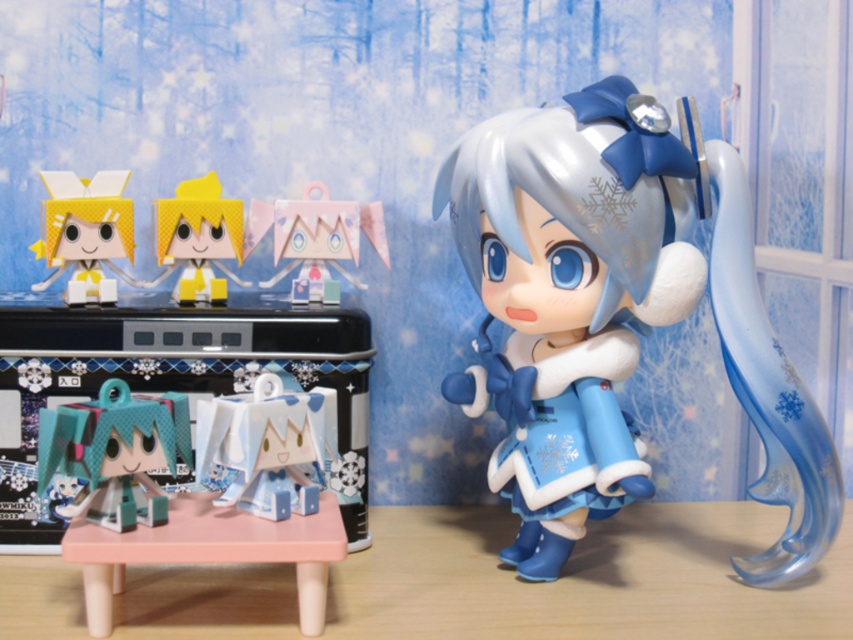
Question: Which point appears closest to the camera in this image?

Choices:
 (A) (137, 515)
 (B) (303, 464)
 (C) (204, 273)
 (D) (384, 253)

Answer: (A)

Question: Which point is farther from the camera taking this photo?

Choices:
 (A) (152, 538)
 (B) (270, 387)
 (C) (206, 285)

Answer: (C)

Question: Which point is farther to the camera?

Choices:
 (A) (99, 595)
 (B) (190, 291)
 (C) (88, 205)

Answer: (B)

Question: Can you confirm if satin blue doll at right is wider than yellow paper doll at upper left?

Choices:
 (A) yes
 (B) no

Answer: (A)

Question: From the image, what is the correct spatial relationship of teal glossy figure at lower left in relation to pink paper origami at center?

Choices:
 (A) right
 (B) left

Answer: (B)

Question: Does satin blue doll at right appear on the left side of pink plastic table at lower center?

Choices:
 (A) no
 (B) yes

Answer: (A)